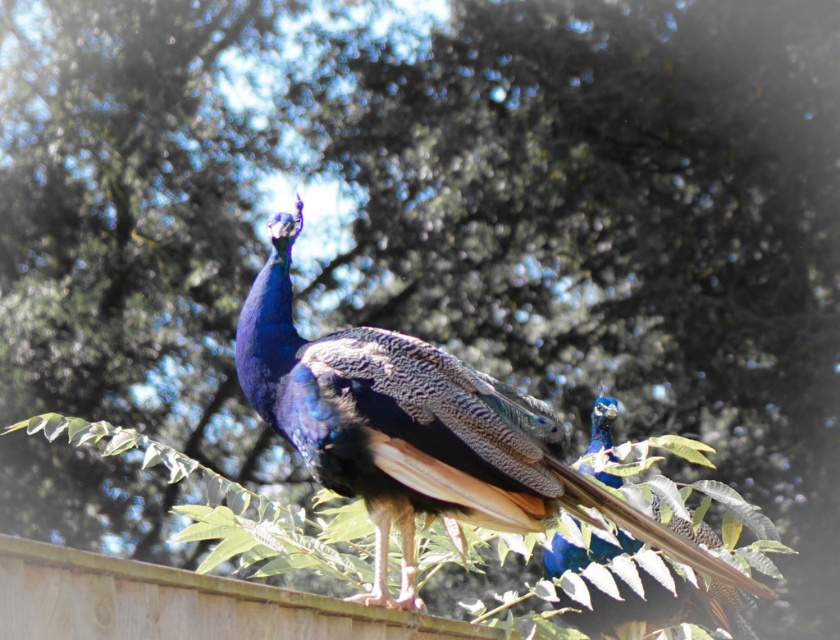
You are a birdwatcher observing two peacocks in the scene. The shiny blue peacock at center and the shiny blue peacock at upper right. Which one is taller?

The shiny blue peacock at center is taller than the shiny blue peacock at upper right.

You are an ornithologist observing two peacocks in the image. The scene shows a shiny blue peacock at center and a shiny blue peacock at upper right. Which peacock has a greater width?

The shiny blue peacock at center has a greater width compared to the shiny blue peacock at upper right as stated in the description.